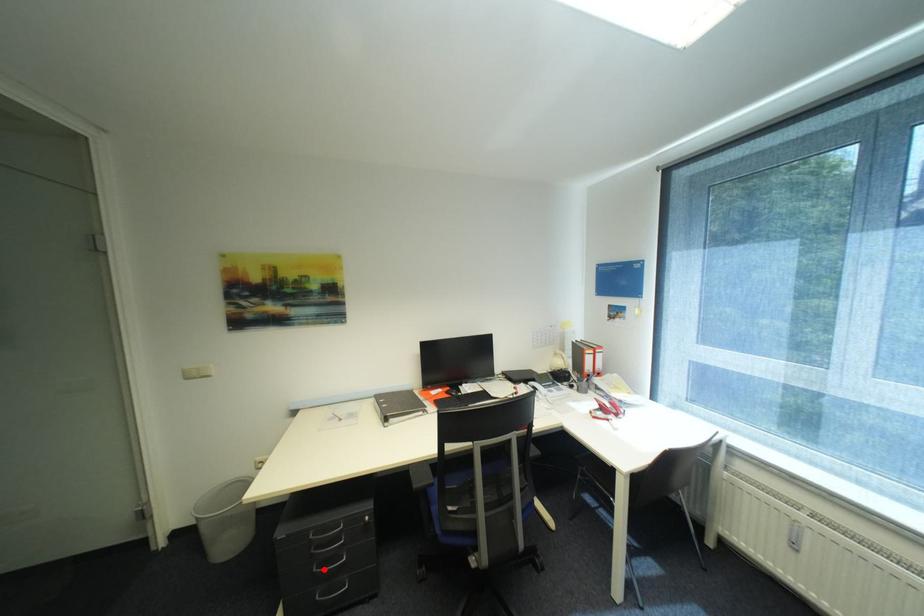
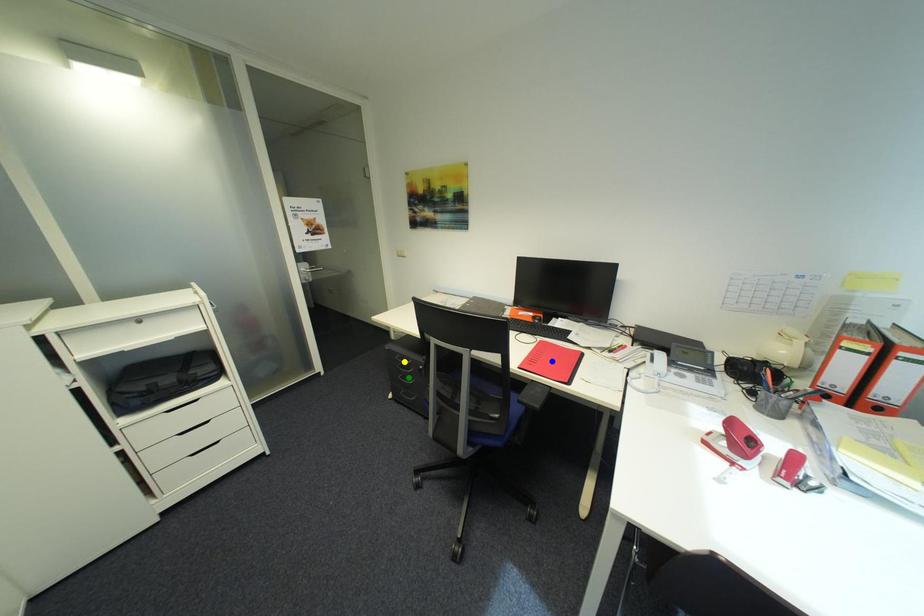
Question: I am providing you with two images of the same scene from different viewpoints. A red point is marked on the first image. You are given multiple points on the second image. In image 2, which mark is for the same physical point as the one in image 1?

Choices:
 (A) green point
 (B) blue point
 (C) yellow point

Answer: (A)